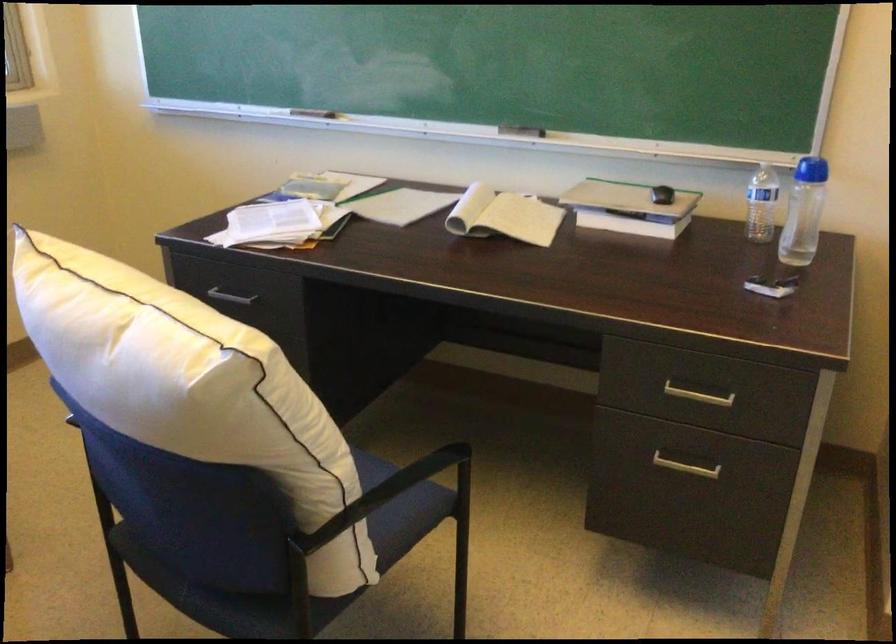
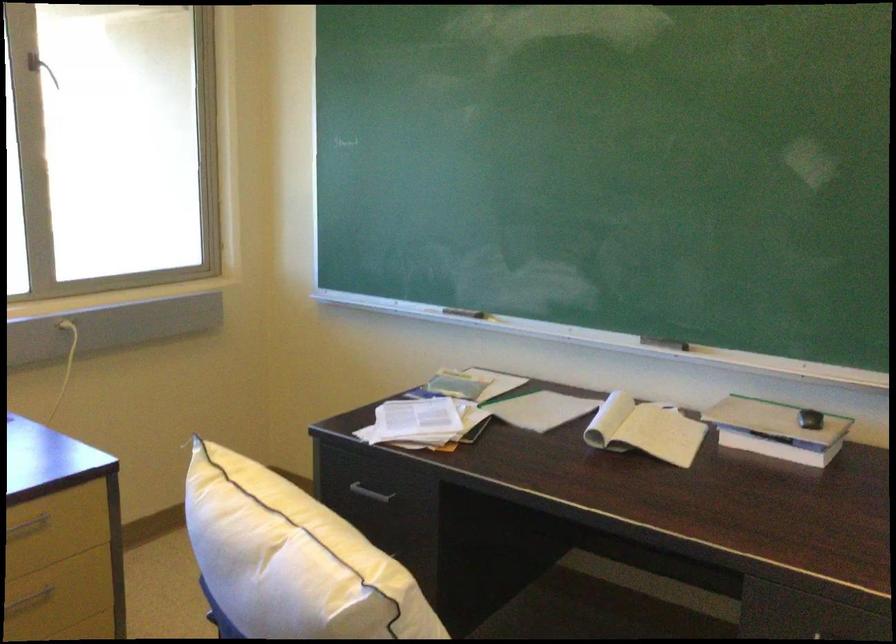
Locate, in the second image, the point that corresponds to (657,198) in the first image.

(810, 419)